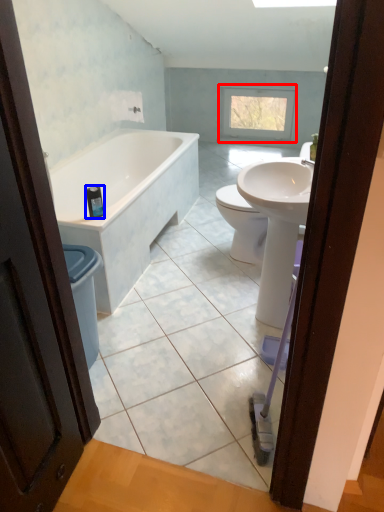
Question: Among these objects, which one is nearest to the camera, window (highlighted by a red box) or toiletry (highlighted by a blue box)?

Choices:
 (A) window
 (B) toiletry

Answer: (B)